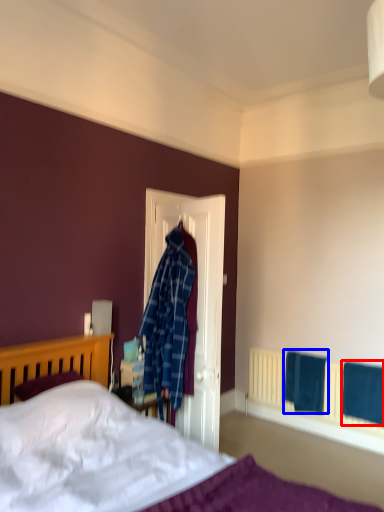
Question: Which object is further to the camera taking this photo, bath towel (highlighted by a red box) or bath towel (highlighted by a blue box)?

Choices:
 (A) bath towel
 (B) bath towel

Answer: (B)